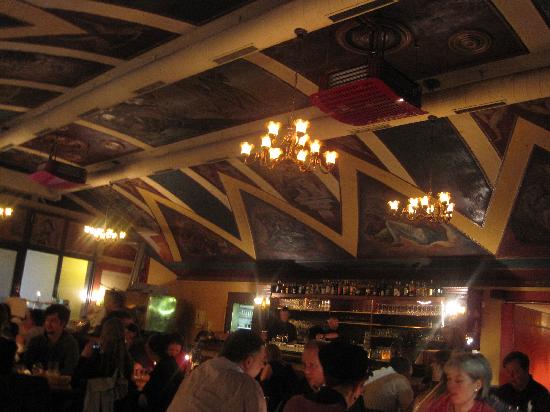
Locate an element on the screen. windows is located at coordinates (46, 284), (78, 283), (10, 270).